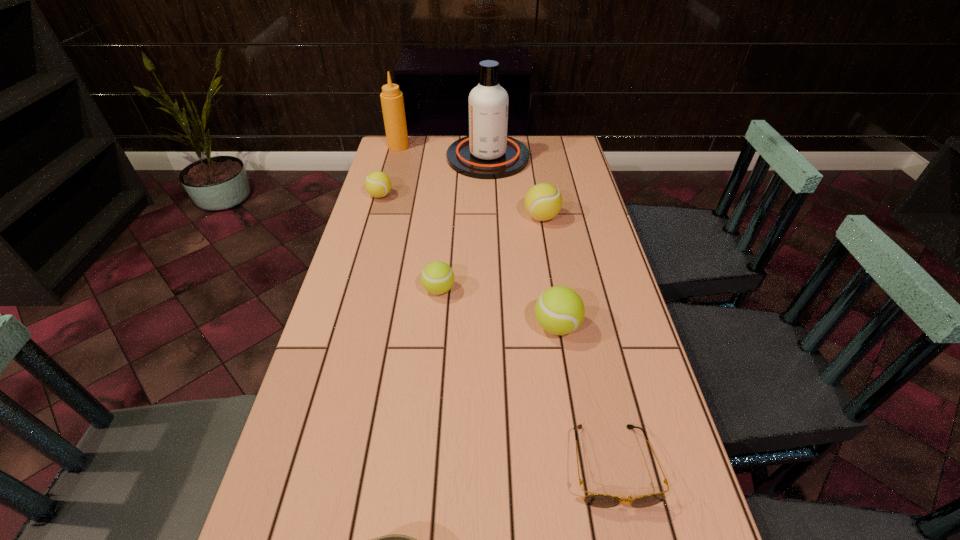
This screenshot has height=540, width=960. What are the coordinates of `empty space that is in between the third farthest object and the tallest object` in the screenshot? It's located at (434, 177).

Identify the location of free area in between the black sunglasses and the condiment. This screenshot has height=540, width=960. (505, 306).

Locate an element on the screen. The image size is (960, 540). free space between the fourth nearest object and the right yellow tennis ball is located at coordinates (491, 253).

At what (x,y) coordinates should I click in order to perform the action: click on blank region between the third farthest object and the seventh farthest object. Please return your answer as a coordinate pair (x, y). The image size is (960, 540). Looking at the image, I should click on (496, 330).

The width and height of the screenshot is (960, 540). Find the location of `free space between the sunglasses and the nearer yellow tennis ball`. free space between the sunglasses and the nearer yellow tennis ball is located at coordinates (577, 341).

Where is `object that is the seventh closest to the condiment`? The image size is (960, 540). object that is the seventh closest to the condiment is located at coordinates (394, 539).

Locate which object ranks fourth in proximity to the third tennis ball from right to left. Please provide its 2D coordinates. Your answer should be formatted as a tuple, i.e. [(x, y)], where the tuple contains the x and y coordinates of a point satisfying the conditions above.

[(596, 500)]

Identify the location of the fourth closest tennis ball relative to the white cleansing agent. This screenshot has width=960, height=540. (559, 310).

Image resolution: width=960 pixels, height=540 pixels. I want to click on tennis ball that is the closest to the sixth farthest object, so click(x=437, y=277).

Where is `blank area in the image that satisfies the following two spatial constraints: 1. on the front side of the sixth farthest object; 2. on the left side of the left yellow tennis ball`? The height and width of the screenshot is (540, 960). blank area in the image that satisfies the following two spatial constraints: 1. on the front side of the sixth farthest object; 2. on the left side of the left yellow tennis ball is located at coordinates (343, 326).